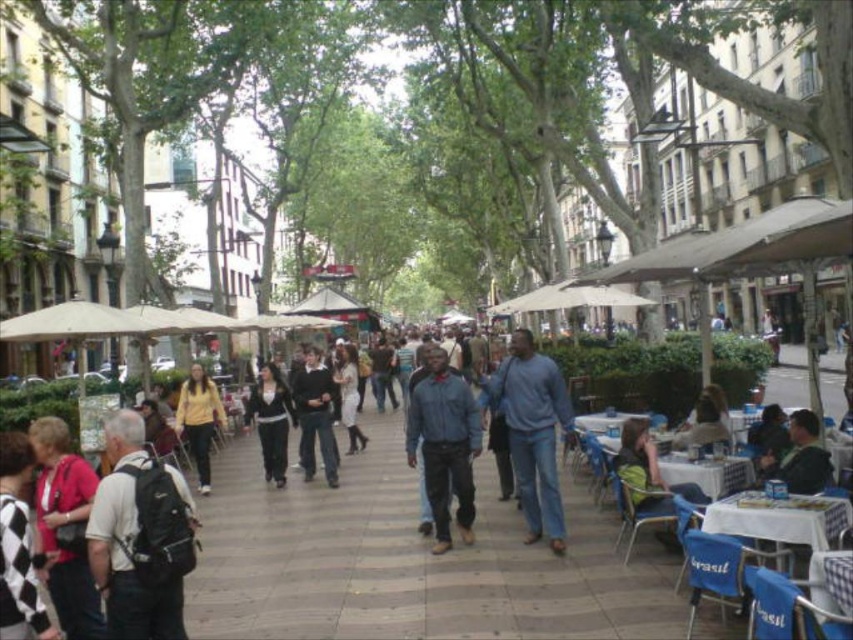
You are a photographer standing in the middle of the street and see two people wearing the dark blue sweater at center and the matte yellow sweater at center. Which sweater is bigger?

The dark blue sweater at center is larger in size than the matte yellow sweater at center.